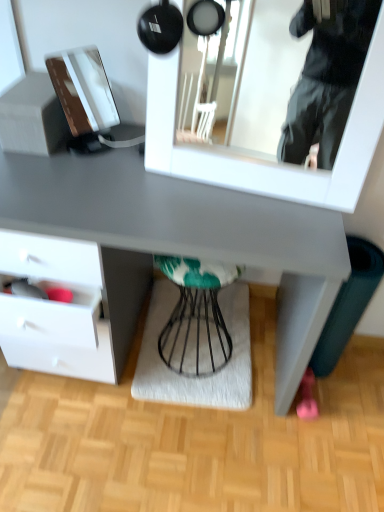
Locate an element on the screen. vacant area in front of white glossy mirror at upper center is located at coordinates (250, 221).